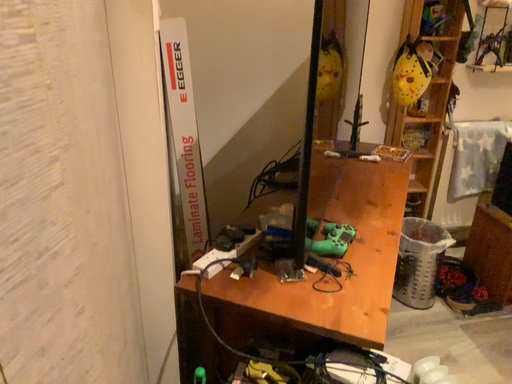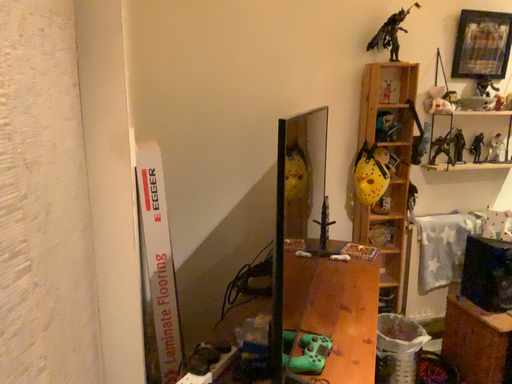
Question: Which way did the camera rotate in the video?

Choices:
 (A) rotated downward
 (B) rotated upward

Answer: (B)